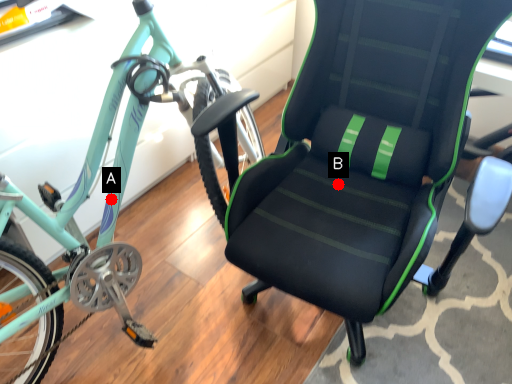
Question: Two points are circled on the image, labeled by A and B beside each circle. Which point is farther to the camera?

Choices:
 (A) A is further
 (B) B is further

Answer: (B)